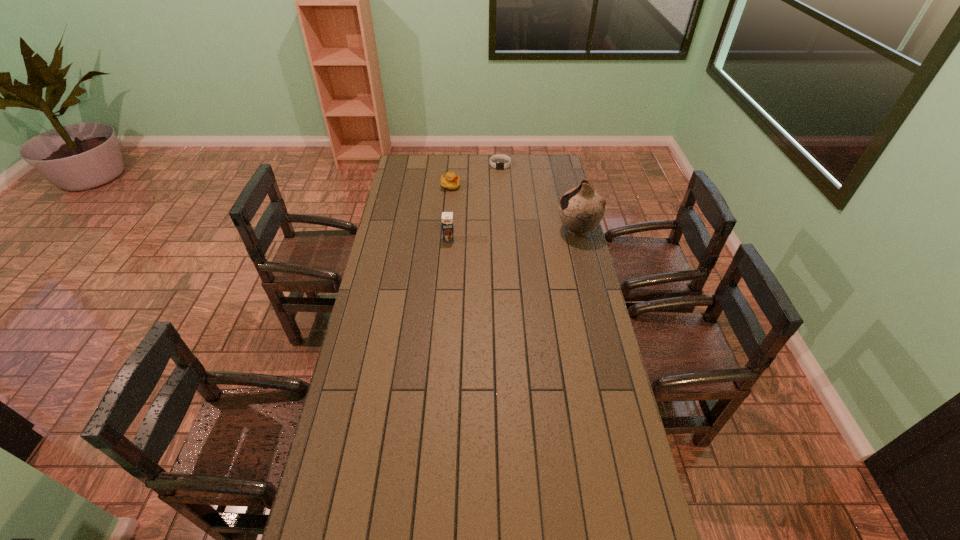
In the image, there is a desktop. Where is `free space at the left edge`? The height and width of the screenshot is (540, 960). free space at the left edge is located at coordinates (332, 480).

Where is `vacant position at the right edge of the desktop`? Image resolution: width=960 pixels, height=540 pixels. vacant position at the right edge of the desktop is located at coordinates (579, 303).

The width and height of the screenshot is (960, 540). In the image, there is a desktop. In order to click on vacant space at the far left corner in this screenshot , I will do [x=414, y=157].

What are the coordinates of `vacant space that's between the duckling and the tallest object` in the screenshot? It's located at [514, 208].

Locate an element on the screen. The image size is (960, 540). unoccupied area between the wristband and the second tallest object is located at coordinates (474, 202).

At what (x,y) coordinates should I click in order to perform the action: click on free space between the chocolate milk and the farthest object. Please return your answer as a coordinate pair (x, y). The width and height of the screenshot is (960, 540). Looking at the image, I should click on (474, 202).

What are the coordinates of `free space between the chocolate milk and the shortest object` in the screenshot? It's located at (474, 202).

Where is `free space between the chocolate milk and the shortest object`? free space between the chocolate milk and the shortest object is located at coordinates (474, 202).

You are a GUI agent. You are given a task and a screenshot of the screen. Output one action in this format:
    pyautogui.click(x=<x>, y=<y>)
    Task: Click on the vacant space that is in between the duckling and the rightmost object
    
    Given the screenshot: What is the action you would take?
    pyautogui.click(x=514, y=208)

Identify the location of free space between the second tallest object and the farthest object. The image size is (960, 540). (474, 202).